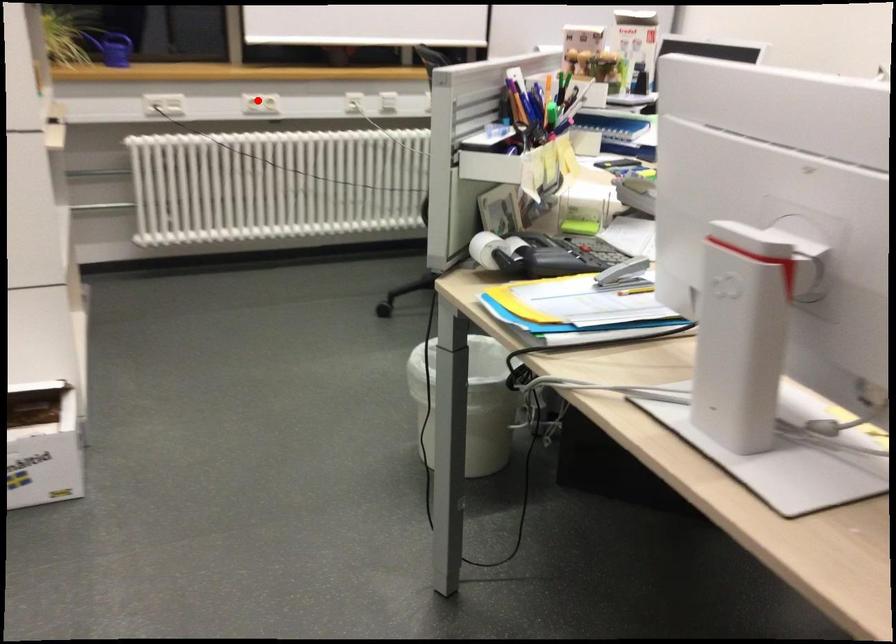
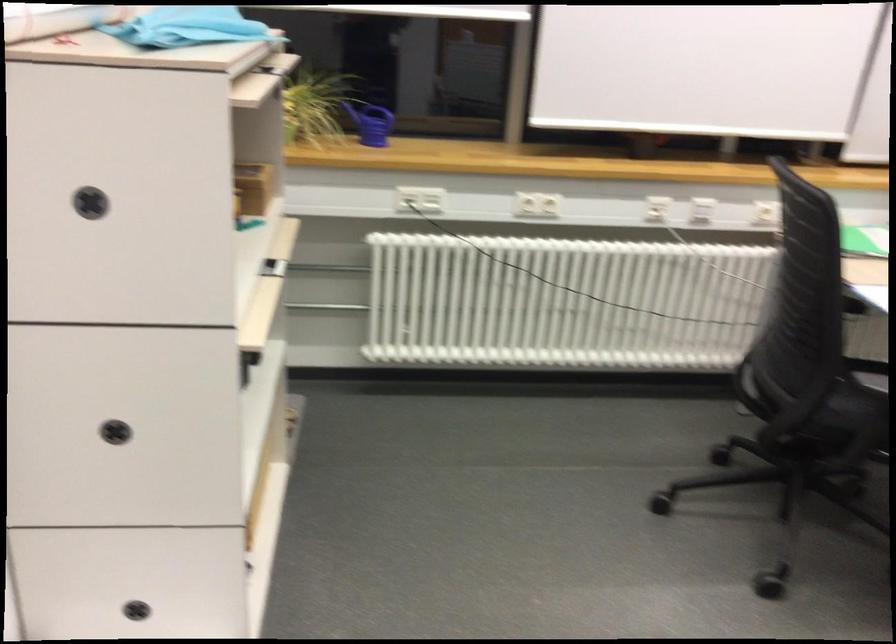
Question: I am providing you with two images of the same scene from different viewpoints. A red point is shown in image1. For the corresponding object point in image2, is it positioned nearer or farther from the camera?

Choices:
 (A) Nearer
 (B) Farther

Answer: (A)